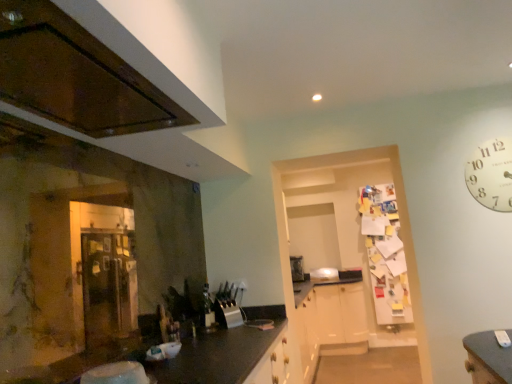
Question: Is white paper clock at upper right positioned beyond the bounds of satin silver toaster at center?

Choices:
 (A) no
 (B) yes

Answer: (B)

Question: Is white paper clock at upper right oriented away from satin silver toaster at center?

Choices:
 (A) no
 (B) yes

Answer: (A)

Question: Does white paper clock at upper right appear on the left side of satin silver toaster at center?

Choices:
 (A) no
 (B) yes

Answer: (A)

Question: Is white paper clock at upper right oriented towards satin silver toaster at center?

Choices:
 (A) yes
 (B) no

Answer: (B)

Question: Can you confirm if white paper clock at upper right is bigger than satin silver toaster at center?

Choices:
 (A) yes
 (B) no

Answer: (B)

Question: Do you think satin silver toaster at center is within glossy wood cabinetry at upper left, or outside of it?

Choices:
 (A) outside
 (B) inside

Answer: (A)

Question: Is point (298, 266) positioned closer to the camera than point (49, 3)?

Choices:
 (A) closer
 (B) farther

Answer: (B)

Question: Considering their positions, is satin silver toaster at center located in front of or behind glossy wood cabinetry at upper left?

Choices:
 (A) behind
 (B) front

Answer: (A)

Question: Is satin silver toaster at center bigger or smaller than glossy wood cabinetry at upper left?

Choices:
 (A) big
 (B) small

Answer: (A)

Question: In the image, is white paper clock at upper right positioned in front of or behind glossy wood cabinetry at upper left?

Choices:
 (A) front
 (B) behind

Answer: (B)

Question: Based on their positions, is white paper clock at upper right located to the left or right of glossy wood cabinetry at upper left?

Choices:
 (A) left
 (B) right

Answer: (B)

Question: Considering the positions of white paper clock at upper right and glossy wood cabinetry at upper left in the image, is white paper clock at upper right taller or shorter than glossy wood cabinetry at upper left?

Choices:
 (A) short
 (B) tall

Answer: (B)

Question: In terms of width, does white paper clock at upper right look wider or thinner when compared to glossy wood cabinetry at upper left?

Choices:
 (A) thin
 (B) wide

Answer: (A)

Question: Visually, is satin silver toaster at center positioned to the left or to the right of white paper clock at upper right?

Choices:
 (A) right
 (B) left

Answer: (B)

Question: Is point [302, 271] positioned closer to the camera than point [465, 170]?

Choices:
 (A) closer
 (B) farther

Answer: (B)